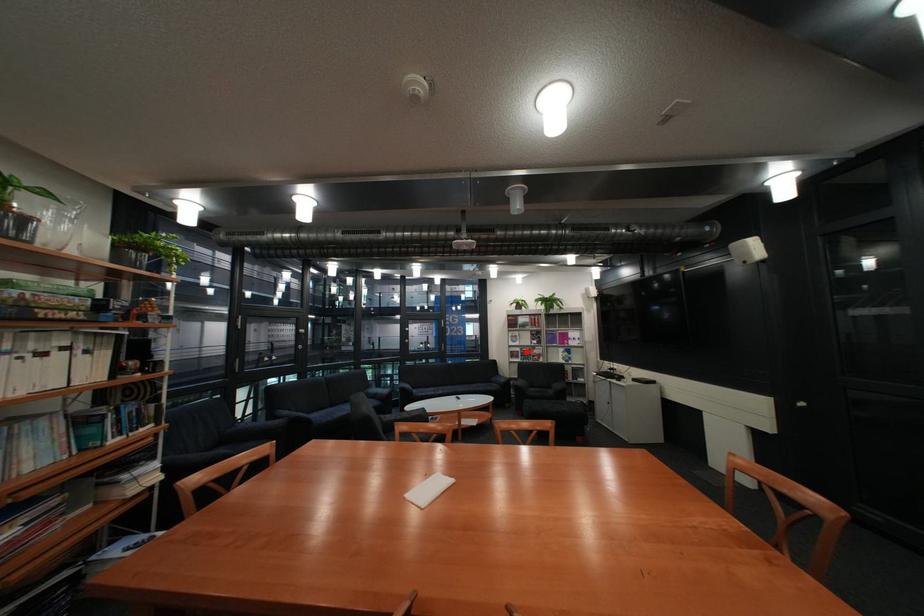
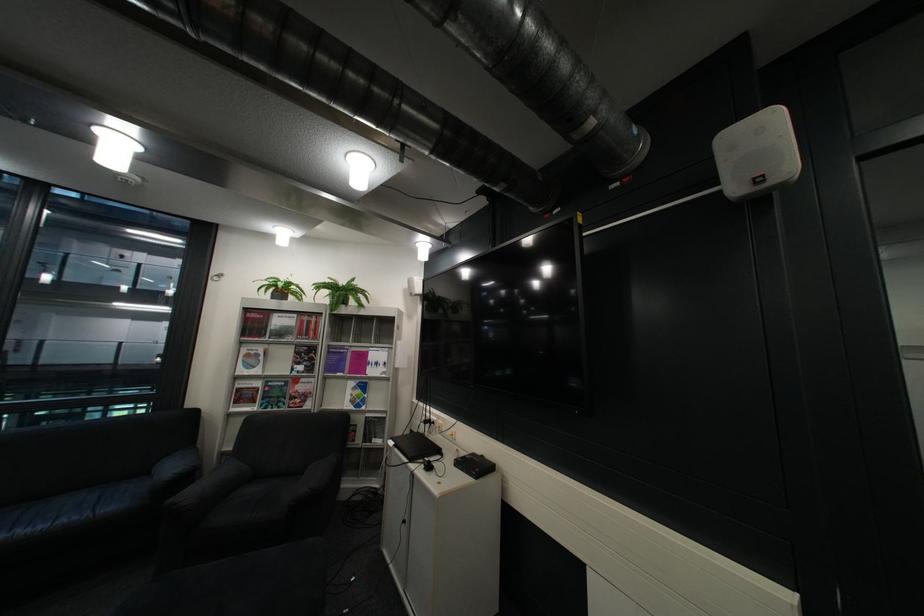
Find the pixel in the second image that matches the highlighted location in the first image.

(254, 390)